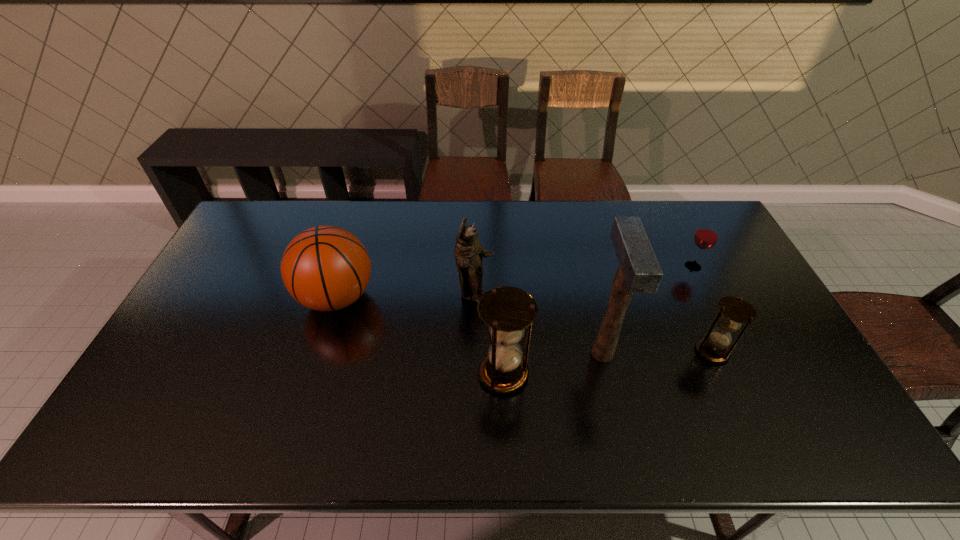
You are a GUI agent. You are given a task and a screenshot of the screen. Output one action in this format:
    pyautogui.click(x=<x>, y=<y>)
    Task: Click on the free point between the shorter hourglass and the tallest object
    This screenshot has width=960, height=540.
    Given the screenshot: What is the action you would take?
    pyautogui.click(x=658, y=352)

Find the location of a particular element. The image size is (960, 540). vacant point located between the figurine and the basketball is located at coordinates (406, 296).

At what (x,y) coordinates should I click in order to perform the action: click on object that stands as the second closest to the leftmost object. Please return your answer as a coordinate pair (x, y). The image size is (960, 540). Looking at the image, I should click on (507, 311).

Identify the location of object that stands as the closest to the fourth object from left to right. This screenshot has height=540, width=960. (507, 311).

This screenshot has height=540, width=960. I want to click on free spot that satisfies the following two spatial constraints: 1. on the back side of the basketball; 2. on the right side of the glass, so click(347, 266).

Find the location of a particular element. The height and width of the screenshot is (540, 960). blank space that satisfies the following two spatial constraints: 1. on the back side of the right hourglass; 2. on the right side of the glass is located at coordinates (674, 266).